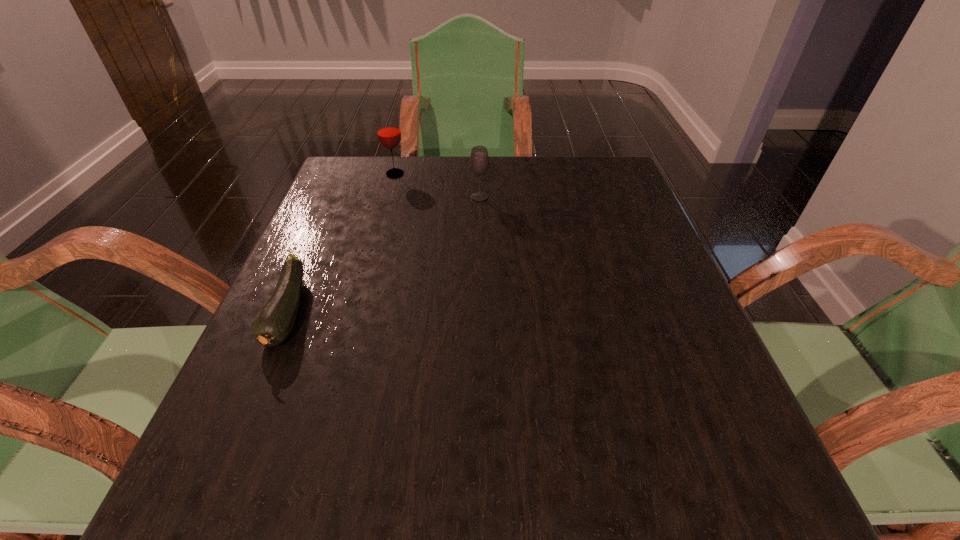
Locate an element on the screen. This screenshot has height=540, width=960. vacant region between the shorter glass drink container and the nearest object is located at coordinates (384, 254).

Image resolution: width=960 pixels, height=540 pixels. In order to click on free space between the farthest object and the zucchini in this screenshot , I will do `click(342, 243)`.

In order to click on vacant area between the zucchini and the taller glass drink container in this screenshot , I will do `click(342, 243)`.

This screenshot has height=540, width=960. I want to click on vacant area that lies between the right glass drink container and the nearest object, so click(384, 254).

The height and width of the screenshot is (540, 960). In order to click on unoccupied position between the nearest object and the nearer glass drink container in this screenshot , I will do `click(384, 254)`.

Identify the location of vacant region between the taller glass drink container and the zucchini. (342, 243).

Locate an element on the screen. The height and width of the screenshot is (540, 960). free space that is in between the farthest object and the shortest object is located at coordinates (342, 243).

Locate an element on the screen. Image resolution: width=960 pixels, height=540 pixels. free space between the right glass drink container and the shortest object is located at coordinates (384, 254).

You are a GUI agent. You are given a task and a screenshot of the screen. Output one action in this format:
    pyautogui.click(x=<x>, y=<y>)
    Task: Click on the closest object to the farthest object
    Image resolution: width=960 pixels, height=540 pixels.
    Given the screenshot: What is the action you would take?
    pyautogui.click(x=479, y=160)

You are a GUI agent. You are given a task and a screenshot of the screen. Output one action in this format:
    pyautogui.click(x=<x>, y=<y>)
    Task: Click on the object that is the closest to the nearer glass drink container
    The height and width of the screenshot is (540, 960).
    Given the screenshot: What is the action you would take?
    pyautogui.click(x=388, y=130)